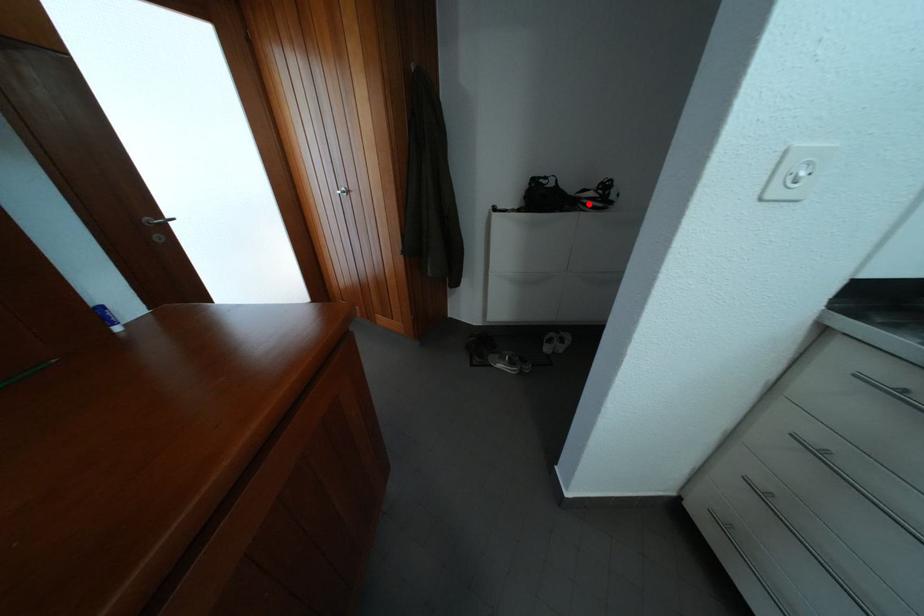
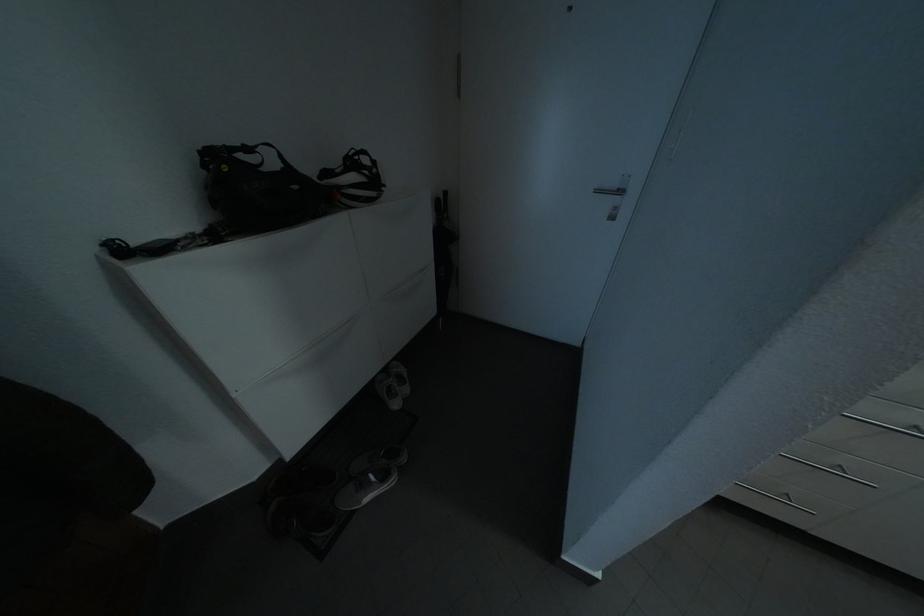
Find the pixel in the second image that matches the highlighted location in the first image.

(348, 193)